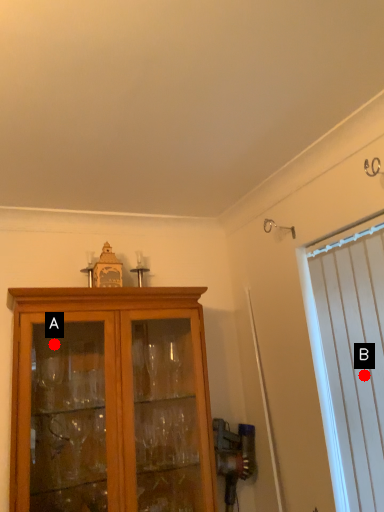
Question: Two points are circled on the image, labeled by A and B beside each circle. Which point is farther to the camera?

Choices:
 (A) A is further
 (B) B is further

Answer: (A)